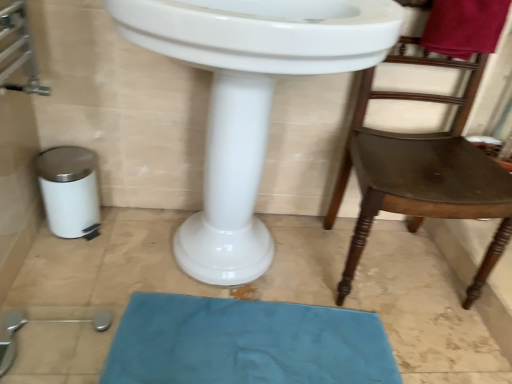
Question: Is brown wooden chair at right at the right side of white glossy sink at center?

Choices:
 (A) no
 (B) yes

Answer: (B)

Question: From a real-world perspective, is brown wooden chair at right on top of white glossy sink at center?

Choices:
 (A) no
 (B) yes

Answer: (A)

Question: Is brown wooden chair at right at the left side of white glossy sink at center?

Choices:
 (A) no
 (B) yes

Answer: (A)

Question: Is brown wooden chair at right with white glossy sink at center?

Choices:
 (A) yes
 (B) no

Answer: (B)

Question: Does brown wooden chair at right have a smaller size compared to white glossy sink at center?

Choices:
 (A) no
 (B) yes

Answer: (B)

Question: Considering the positions of blue fabric bath mat at lower center and brown wooden chair at right in the image, is blue fabric bath mat at lower center bigger or smaller than brown wooden chair at right?

Choices:
 (A) small
 (B) big

Answer: (A)

Question: Is point click(156, 301) closer or farther from the camera than point click(410, 200)?

Choices:
 (A) farther
 (B) closer

Answer: (A)

Question: Considering the positions of blue fabric bath mat at lower center and brown wooden chair at right in the image, is blue fabric bath mat at lower center wider or thinner than brown wooden chair at right?

Choices:
 (A) thin
 (B) wide

Answer: (A)

Question: Would you say blue fabric bath mat at lower center is inside or outside brown wooden chair at right?

Choices:
 (A) outside
 (B) inside

Answer: (A)

Question: Is white glossy sink at center inside or outside of blue fabric bath mat at lower center?

Choices:
 (A) outside
 (B) inside

Answer: (A)

Question: From the image's perspective, is white glossy sink at center located above or below blue fabric bath mat at lower center?

Choices:
 (A) below
 (B) above

Answer: (B)

Question: Relative to blue fabric bath mat at lower center, is white glossy sink at center in front or behind?

Choices:
 (A) front
 (B) behind

Answer: (A)

Question: From a real-world perspective, is white glossy sink at center positioned above or below blue fabric bath mat at lower center?

Choices:
 (A) below
 (B) above

Answer: (B)

Question: Visually, is blue fabric bath mat at lower center positioned to the left or to the right of white glossy sink at center?

Choices:
 (A) right
 (B) left

Answer: (A)

Question: Would you say blue fabric bath mat at lower center is inside or outside white glossy sink at center?

Choices:
 (A) inside
 (B) outside

Answer: (B)